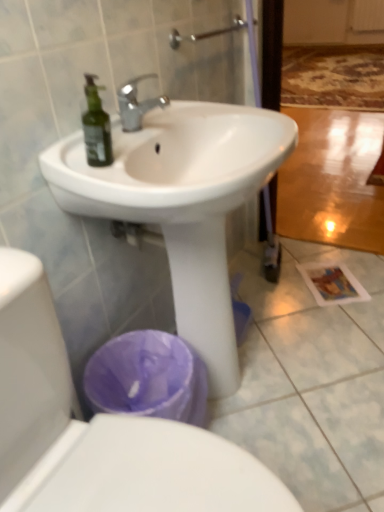
Identify the location of white glossy toilet at lower left. The width and height of the screenshot is (384, 512). (100, 430).

What do you see at coordinates (100, 430) in the screenshot? I see `white glossy toilet at lower left` at bounding box center [100, 430].

Image resolution: width=384 pixels, height=512 pixels. What do you see at coordinates (182, 203) in the screenshot? I see `white glossy sink at center` at bounding box center [182, 203].

This screenshot has width=384, height=512. In order to click on white glossy sink at center in this screenshot , I will do `click(182, 203)`.

The height and width of the screenshot is (512, 384). Identify the location of white glossy toilet at lower left. (100, 430).

Based on their positions, is white glossy sink at center located to the left or right of white glossy toilet at lower left?

In the image, white glossy sink at center appears on the right side of white glossy toilet at lower left.

Which is in front, white glossy sink at center or white glossy toilet at lower left?

Positioned in front is white glossy toilet at lower left.

Is point (103, 207) positioned behind point (26, 273)?

That is True.

From the image's perspective, which one is positioned lower, white glossy sink at center or white glossy toilet at lower left?

white glossy toilet at lower left.

From a real-world perspective, is white glossy sink at center on top of white glossy toilet at lower left?

Yes, from a real-world perspective, white glossy sink at center is over white glossy toilet at lower left

Does white glossy sink at center have a greater width compared to white glossy toilet at lower left?

A: No, white glossy sink at center is not wider than white glossy toilet at lower left.

Can you confirm if white glossy sink at center is taller than white glossy toilet at lower left?

Correct, white glossy sink at center is much taller as white glossy toilet at lower left.

Is white glossy sink at center smaller than white glossy toilet at lower left?

No.

Can white glossy toilet at lower left be found inside white glossy sink at center?

Actually, white glossy toilet at lower left is outside white glossy sink at center.

Can you see white glossy sink at center touching white glossy toilet at lower left?

They are not placed beside each other.

Is white glossy toilet at lower left at the back of white glossy sink at center?

No, white glossy sink at center is not facing the opposite direction of white glossy toilet at lower left.

What's the angular difference between white glossy sink at center and white glossy toilet at lower left's facing directions?

white glossy sink at center and white glossy toilet at lower left are facing 1.86 degrees away from each other.

Locate an element on the screen. Image resolution: width=384 pixels, height=512 pixels. toilet below the white glossy sink at center (from a real-world perspective) is located at coordinates (100, 430).

Is white glossy toilet at lower left at the left side of white glossy sink at center?

Indeed, white glossy toilet at lower left is positioned on the left side of white glossy sink at center.

Is white glossy toilet at lower left in front of or behind white glossy sink at center in the image?

white glossy toilet at lower left is in front of white glossy sink at center.

Does point (66, 487) come behind point (118, 139)?

No, it is in front of (118, 139).

From the image's perspective, relative to white glossy sink at center, is white glossy toilet at lower left above or below?

white glossy toilet at lower left is situated lower than white glossy sink at center in the image.

Consider the image. From a real-world perspective, which object rests below the other?

From a 3D spatial view, white glossy toilet at lower left is below.

Considering the sizes of objects white glossy toilet at lower left and white glossy sink at center in the image provided, who is thinner, white glossy toilet at lower left or white glossy sink at center?

white glossy sink at center.

Is white glossy toilet at lower left taller or shorter than white glossy sink at center?

Considering their sizes, white glossy toilet at lower left has less height than white glossy sink at center.

Considering the relative sizes of white glossy toilet at lower left and white glossy sink at center in the image provided, is white glossy toilet at lower left bigger than white glossy sink at center?

Incorrect, white glossy toilet at lower left is not larger than white glossy sink at center.

In the scene shown: Does white glossy toilet at lower left contain white glossy sink at center?

That's incorrect, white glossy sink at center is not inside white glossy toilet at lower left.

Is white glossy toilet at lower left in contact with white glossy sink at center?

white glossy toilet at lower left and white glossy sink at center are clearly separated.

Is white glossy sink at center at the back of white glossy toilet at lower left?

No, white glossy sink at center is not at the back of white glossy toilet at lower left.

Image resolution: width=384 pixels, height=512 pixels. I want to click on sink above the white glossy toilet at lower left (from a real-world perspective), so click(x=182, y=203).

Locate an element on the screen. Image resolution: width=384 pixels, height=512 pixels. toilet in front of the white glossy sink at center is located at coordinates (100, 430).

Where is `toilet below the white glossy sink at center (from the image's perspective)`? toilet below the white glossy sink at center (from the image's perspective) is located at coordinates (100, 430).